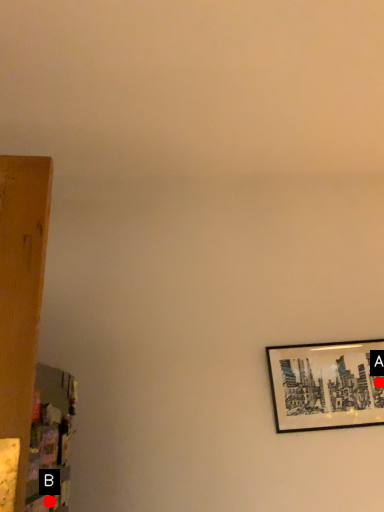
Question: Two points are circled on the image, labeled by A and B beside each circle. Which point is further to the camera?

Choices:
 (A) A is further
 (B) B is further

Answer: (A)